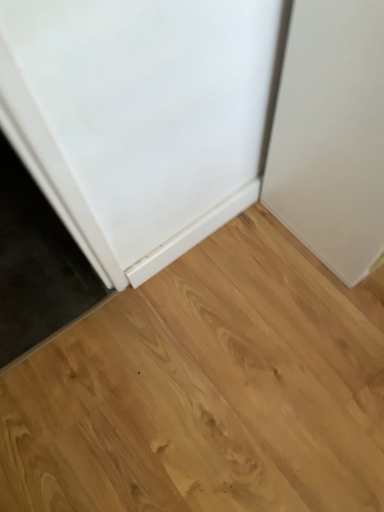
What is the approximate width of white matte door at upper right?

white matte door at upper right is 13.45 inches in width.

At what (x,y) coordinates should I click in order to perform the action: click on white matte door at upper right. Please return your answer as a coordinate pair (x, y). Looking at the image, I should click on (331, 135).

What do you see at coordinates (331, 135) in the screenshot? The width and height of the screenshot is (384, 512). I see `white matte door at upper right` at bounding box center [331, 135].

Describe the element at coordinates (207, 390) in the screenshot. I see `natural wood floor at center` at that location.

What is the approximate height of natural wood floor at center?

natural wood floor at center is 1.33 inches in height.

Identify the location of natural wood floor at center. (x=207, y=390).

Identify the location of white matte door at upper right. The width and height of the screenshot is (384, 512). (331, 135).

Which object is positioned more to the left, white matte door at upper right or natural wood floor at center?

From the viewer's perspective, natural wood floor at center appears more on the left side.

Is white matte door at upper right further to the viewer compared to natural wood floor at center?

No, it is not.

Is point (360, 126) positioned in front of point (123, 490)?

Yes, it is in front of point (123, 490).

From the image's perspective, which is below, white matte door at upper right or natural wood floor at center?

natural wood floor at center appears lower in the image.

From a real-world perspective, is white matte door at upper right physically below natural wood floor at center?

No, from a real-world perspective, white matte door at upper right is not beneath natural wood floor at center.

Which object is wider, white matte door at upper right or natural wood floor at center?

With larger width is natural wood floor at center.

In terms of height, does white matte door at upper right look taller or shorter compared to natural wood floor at center?

white matte door at upper right is taller than natural wood floor at center.

Considering the relative sizes of white matte door at upper right and natural wood floor at center in the image provided, is white matte door at upper right bigger than natural wood floor at center?

Indeed, white matte door at upper right has a larger size compared to natural wood floor at center.

Is white matte door at upper right not within natural wood floor at center?

Yes.

Are white matte door at upper right and natural wood floor at center making contact?

There is a gap between white matte door at upper right and natural wood floor at center.

Does white matte door at upper right turn towards natural wood floor at center?

No, white matte door at upper right is not turned towards natural wood floor at center.

How far apart are white matte door at upper right and natural wood floor at center?

white matte door at upper right is 16.29 inches from natural wood floor at center.

In the image, there is a white matte door at upper right. What are the coordinates of `hardwood below it (from a real-world perspective)` in the screenshot? It's located at (207, 390).

Is natural wood floor at center at the right side of white matte door at upper right?

Incorrect, natural wood floor at center is not on the right side of white matte door at upper right.

Is natural wood floor at center behind white matte door at upper right?

Yes, natural wood floor at center is further from the viewer.

Which is nearer, (145, 508) or (360, 163)?

Positioned in front is point (360, 163).

Consider the image. From the image's perspective, is natural wood floor at center located beneath white matte door at upper right?

Yes, from the image's perspective, natural wood floor at center is beneath white matte door at upper right.

From a real-world perspective, relative to white matte door at upper right, is natural wood floor at center vertically above or below?

Clearly, from a real-world perspective, natural wood floor at center is below white matte door at upper right.

Which of these two, natural wood floor at center or white matte door at upper right, is wider?

Wider between the two is natural wood floor at center.

From their relative heights in the image, would you say natural wood floor at center is taller or shorter than white matte door at upper right?

natural wood floor at center is shorter than white matte door at upper right.

Is natural wood floor at center bigger than white matte door at upper right?

Actually, natural wood floor at center might be smaller than white matte door at upper right.

Would you say natural wood floor at center is inside or outside white matte door at upper right?

natural wood floor at center is located beyond the bounds of white matte door at upper right.

Is natural wood floor at center with white matte door at upper right?

No, natural wood floor at center is not touching white matte door at upper right.

Is natural wood floor at center oriented away from white matte door at upper right?

No, white matte door at upper right is not at the back of natural wood floor at center.

Can you tell me how much natural wood floor at center and white matte door at upper right differ in facing direction?

There is a 180-degree angle between the facing directions of natural wood floor at center and white matte door at upper right.

What are the coordinates of `door above the natural wood floor at center (from a real-world perspective)` in the screenshot? It's located at (331, 135).

The width and height of the screenshot is (384, 512). I want to click on hardwood on the left of white matte door at upper right, so click(x=207, y=390).

This screenshot has height=512, width=384. Identify the location of door in front of the natural wood floor at center. (331, 135).